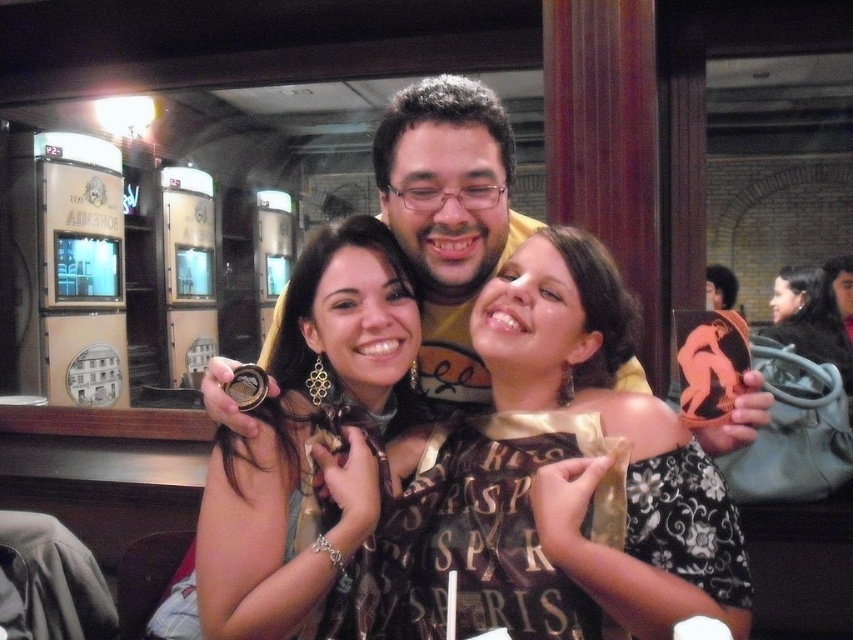
You are a photographer at the event and need to capture a closeup of both the gold chain necklace at center and the matte gold coin at center. Which object will require you to zoom in more to focus on its finer details?

The matte gold coin at center will require more zooming in since it is smaller than the gold chain necklace at center.

You are a photographer at the event and want to take a closeup shot of both necklaces. Since the shiny gold necklace at center and the gold chain necklace at center are both at the center, which one would appear larger in the photo?

The gold chain necklace at center appears larger in the photo because it has a greater height than the shiny gold necklace at center.